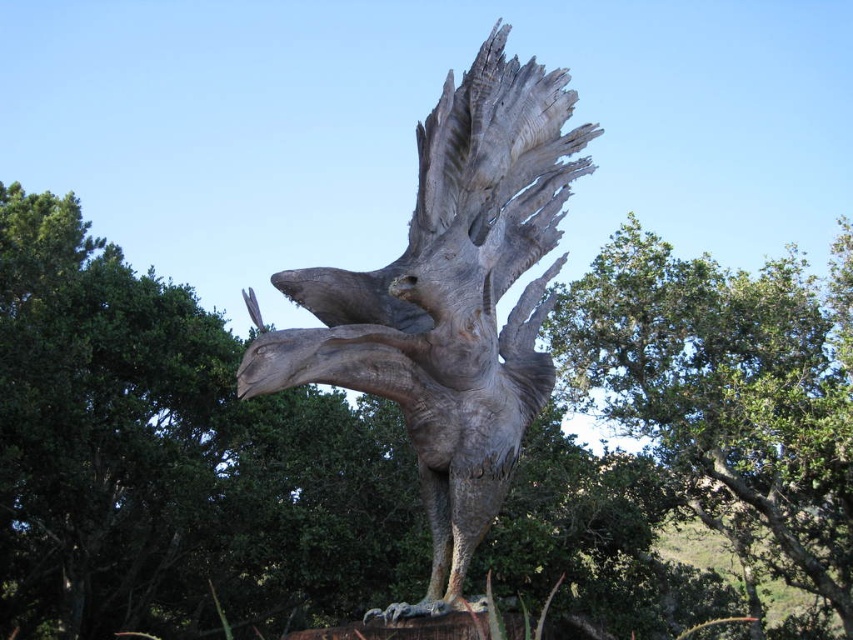
Which of these two, green leafy tree at center or gray stone eagle at center, stands taller?

green leafy tree at center

In the scene shown: Who is more forward, [346,602] or [408,328]?

Positioned in front is point [408,328].

Which is in front, point (643, 481) or point (550, 99)?

Point (550, 99)

Locate an element on the screen. Image resolution: width=853 pixels, height=640 pixels. green leafy tree at center is located at coordinates (173, 460).